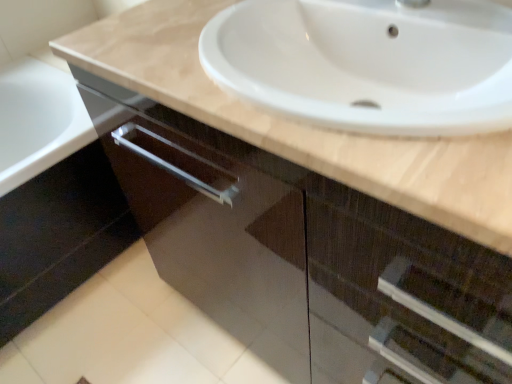
The width and height of the screenshot is (512, 384). What do you see at coordinates (117, 335) in the screenshot?
I see `white glossy tile at lower left` at bounding box center [117, 335].

In order to click on white glossy tile at lower left in this screenshot , I will do `click(117, 335)`.

The width and height of the screenshot is (512, 384). I want to click on white glossy tile at lower left, so click(x=117, y=335).